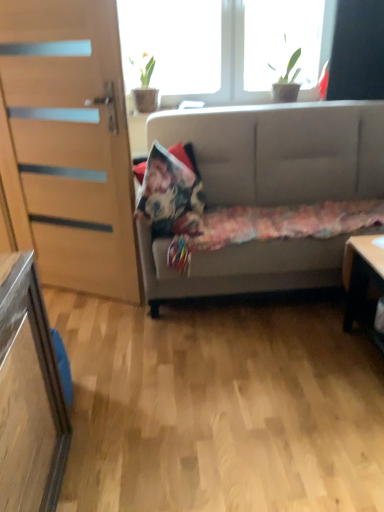
Question: Does floral fabric pillow at center have a smaller size compared to fluffy multicolored blanket at center?

Choices:
 (A) no
 (B) yes

Answer: (B)

Question: Is floral fabric pillow at center not within fluffy multicolored blanket at center?

Choices:
 (A) yes
 (B) no

Answer: (A)

Question: From the image's perspective, does floral fabric pillow at center appear higher than fluffy multicolored blanket at center?

Choices:
 (A) no
 (B) yes

Answer: (B)

Question: Is floral fabric pillow at center not near fluffy multicolored blanket at center?

Choices:
 (A) yes
 (B) no

Answer: (B)

Question: Is floral fabric pillow at center positioned in front of fluffy multicolored blanket at center?

Choices:
 (A) yes
 (B) no

Answer: (B)

Question: Does floral fabric pillow at center turn towards fluffy multicolored blanket at center?

Choices:
 (A) no
 (B) yes

Answer: (A)

Question: Is light gray fabric couch at center far away from green leafy plant at upper right, which is counted as the 2th window, starting from the left?

Choices:
 (A) no
 (B) yes

Answer: (A)

Question: Can you confirm if light gray fabric couch at center is positioned to the left of green leafy plant at upper right, which is counted as the 2th window, starting from the left?

Choices:
 (A) no
 (B) yes

Answer: (B)

Question: Considering the relative sizes of light gray fabric couch at center and green leafy plant at upper right, which is counted as the 2th window, starting from the left, in the image provided, is light gray fabric couch at center shorter than green leafy plant at upper right, which is counted as the 2th window, starting from the left,?

Choices:
 (A) no
 (B) yes

Answer: (A)

Question: Does light gray fabric couch at center contain green leafy plant at upper right, which is the 1th window from right to left?

Choices:
 (A) no
 (B) yes

Answer: (A)

Question: Is the depth of light gray fabric couch at center less than that of green leafy plant at upper right, which is the 1th window from right to left?

Choices:
 (A) no
 (B) yes

Answer: (B)

Question: Is light gray fabric couch at center positioned beyond the bounds of green leafy plant at upper right, which is the 1th window from right to left?

Choices:
 (A) yes
 (B) no

Answer: (A)

Question: Is light gray fabric couch at center thinner than transparent glass window at upper center, which is the 2th window in right-to-left order?

Choices:
 (A) no
 (B) yes

Answer: (A)